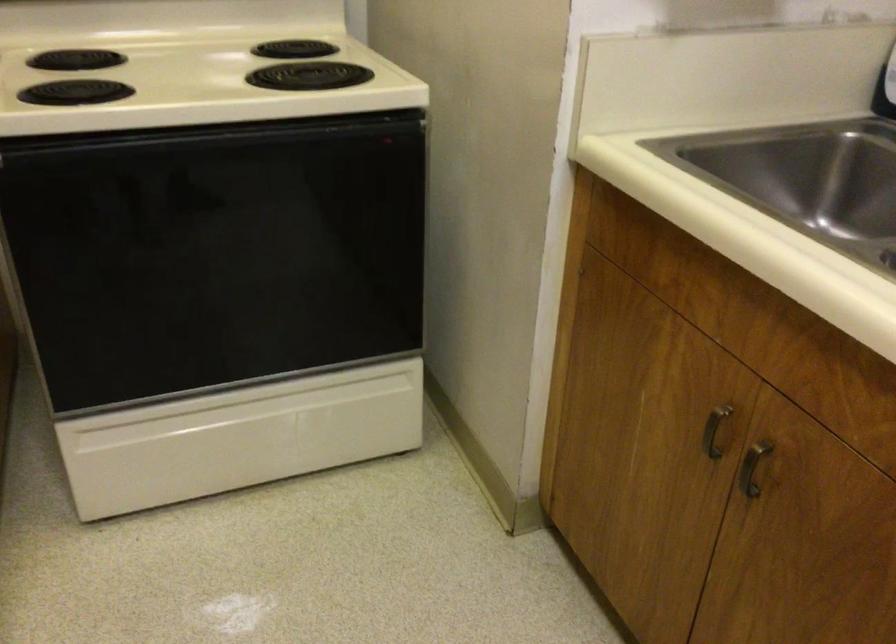
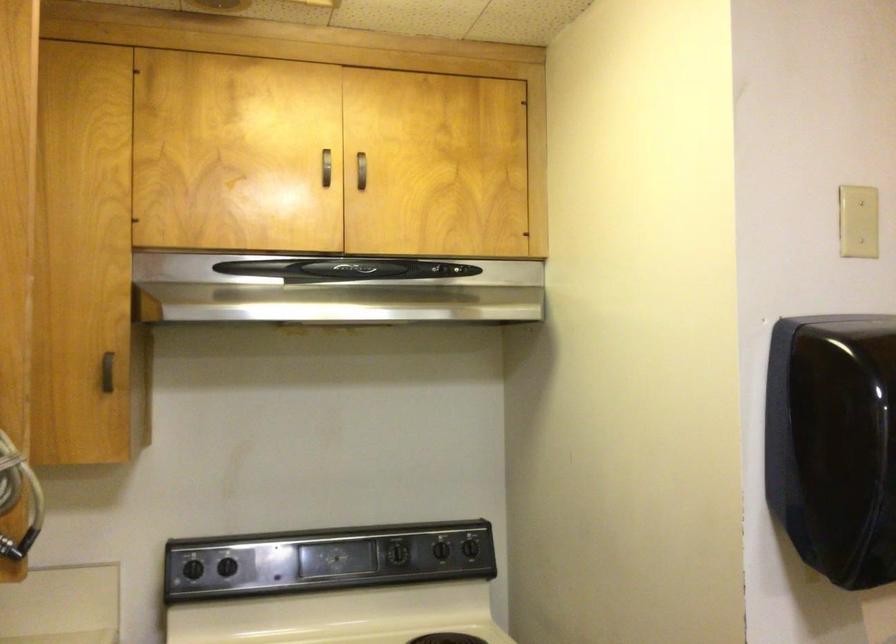
Question: Based on the continuous images, in which direction is the camera rotating? Reply with the corresponding letter.

Choices:
 (A) Left
 (B) Right
 (C) Up
 (D) Down

Answer: (C)